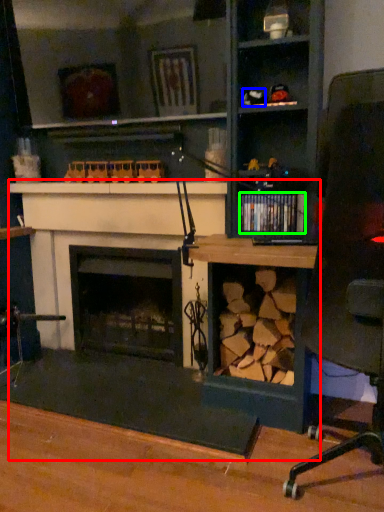
Question: Which object is the farthest from computer desk (highlighted by a red box)? Choose among these: toy (highlighted by a blue box) or book (highlighted by a green box).

Choices:
 (A) toy
 (B) book

Answer: (A)